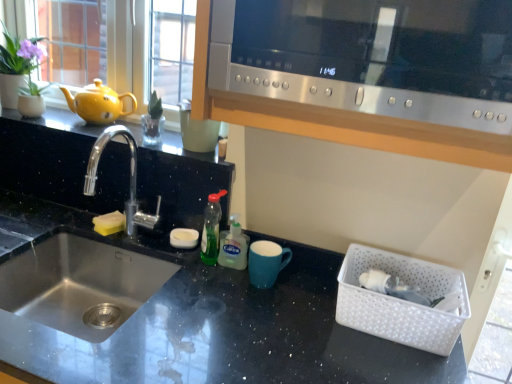
Where is `vacant area situated below satin silver microwave at upper center (from a real-world perspective)`? The image size is (512, 384). vacant area situated below satin silver microwave at upper center (from a real-world perspective) is located at coordinates (303, 300).